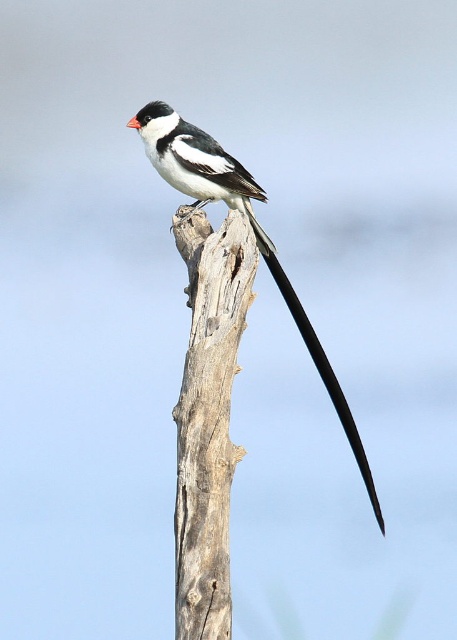
Question: Which point appears farthest from the camera in this image?

Choices:
 (A) coord(190,548)
 (B) coord(328,388)
 (C) coord(191,161)

Answer: (B)

Question: Does gray rough wood at center have a lesser width compared to white glossy bird at center?

Choices:
 (A) no
 (B) yes

Answer: (B)

Question: Is gray rough wood at center above white glossy bird at center?

Choices:
 (A) yes
 (B) no

Answer: (B)

Question: Does gray rough wood at center lie behind black glossy tail at upper center?

Choices:
 (A) yes
 (B) no

Answer: (B)

Question: Which object is the farthest from the black glossy tail at upper center?

Choices:
 (A) gray rough wood at center
 (B) white glossy bird at center

Answer: (A)

Question: Which of these objects is positioned farthest from the black glossy tail at upper center?

Choices:
 (A) white glossy bird at center
 (B) gray rough wood at center

Answer: (B)